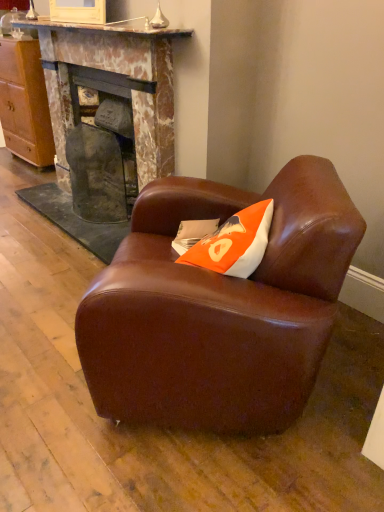
Question: Is brown leather armchair at center taller than orange fabric pillow at center?

Choices:
 (A) yes
 (B) no

Answer: (A)

Question: Is brown leather armchair at center outside of orange fabric pillow at center?

Choices:
 (A) no
 (B) yes

Answer: (B)

Question: Could orange fabric pillow at center be considered to be inside brown leather armchair at center?

Choices:
 (A) yes
 (B) no

Answer: (A)

Question: Considering the relative sizes of brown leather armchair at center and orange fabric pillow at center in the image provided, is brown leather armchair at center smaller than orange fabric pillow at center?

Choices:
 (A) yes
 (B) no

Answer: (B)

Question: Does brown leather armchair at center come behind orange fabric pillow at center?

Choices:
 (A) no
 (B) yes

Answer: (A)

Question: In the image, is wooden cabinet at left positioned in front of or behind brown leather armchair at center?

Choices:
 (A) behind
 (B) front

Answer: (A)

Question: In terms of size, does wooden cabinet at left appear bigger or smaller than brown leather armchair at center?

Choices:
 (A) big
 (B) small

Answer: (B)

Question: Is wooden cabinet at left situated inside brown leather armchair at center or outside?

Choices:
 (A) inside
 (B) outside

Answer: (B)

Question: Does point (41, 138) appear closer or farther from the camera than point (120, 250)?

Choices:
 (A) farther
 (B) closer

Answer: (A)

Question: Based on their positions, is wooden cabinet at left located to the left or right of orange fabric pillow at center?

Choices:
 (A) left
 (B) right

Answer: (A)

Question: Considering the positions of wooden cabinet at left and orange fabric pillow at center in the image, is wooden cabinet at left taller or shorter than orange fabric pillow at center?

Choices:
 (A) short
 (B) tall

Answer: (B)

Question: Looking at the image, does wooden cabinet at left seem bigger or smaller compared to orange fabric pillow at center?

Choices:
 (A) small
 (B) big

Answer: (B)

Question: Relative to orange fabric pillow at center, is wooden cabinet at left in front or behind?

Choices:
 (A) behind
 (B) front

Answer: (A)

Question: From the image's perspective, relative to wooden cabinet at left, is brown leather armchair at center above or below?

Choices:
 (A) above
 (B) below

Answer: (B)

Question: Is brown leather armchair at center taller or shorter than wooden cabinet at left?

Choices:
 (A) short
 (B) tall

Answer: (A)